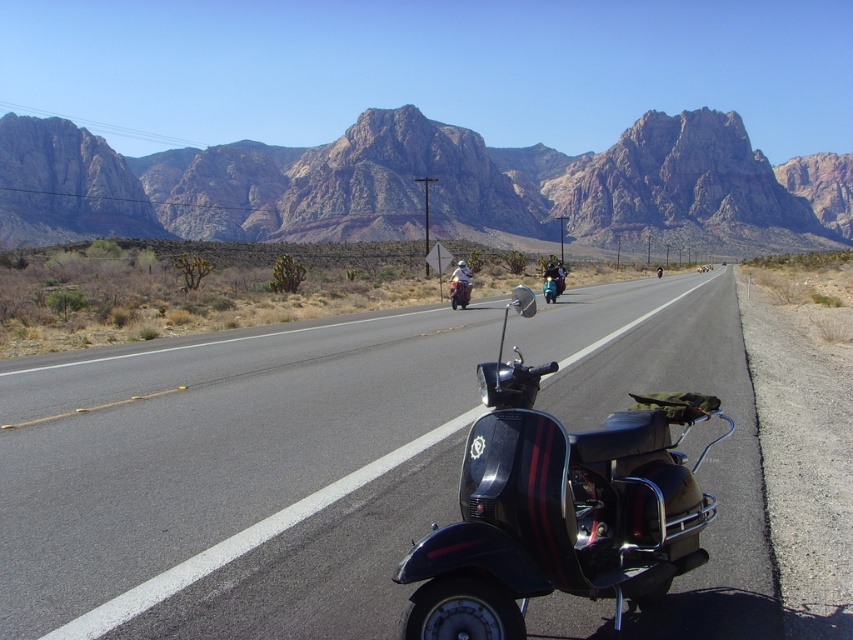
You are a delivery person who needs to load a package onto the black matte scooter at center and the matte black scooter at center. Which scooter should you approach first to place the package on top?

The black matte scooter at center is positioned under the matte black scooter at center, so you should approach the matte black scooter at center first to place the package on top since it is above the other one.

You are a photographer planning to take a picture of the black matte scooter at center and the white matte helmet at center. Since you want to ensure both objects are clearly visible in the frame, which object should you focus on first to account for their sizes?

The white matte helmet at center should be focused on first because it is wider than the black matte scooter at center, ensuring proper focus on the larger object.